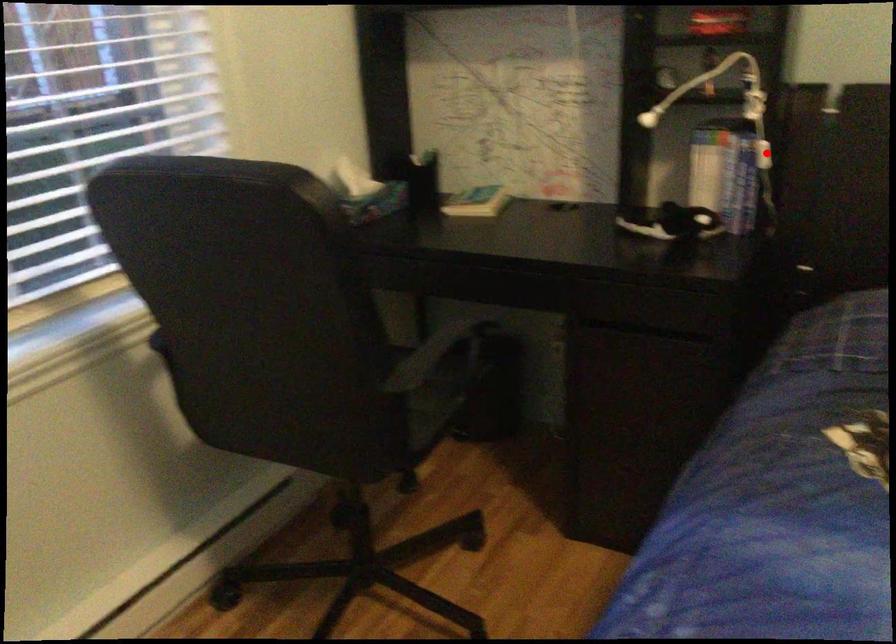
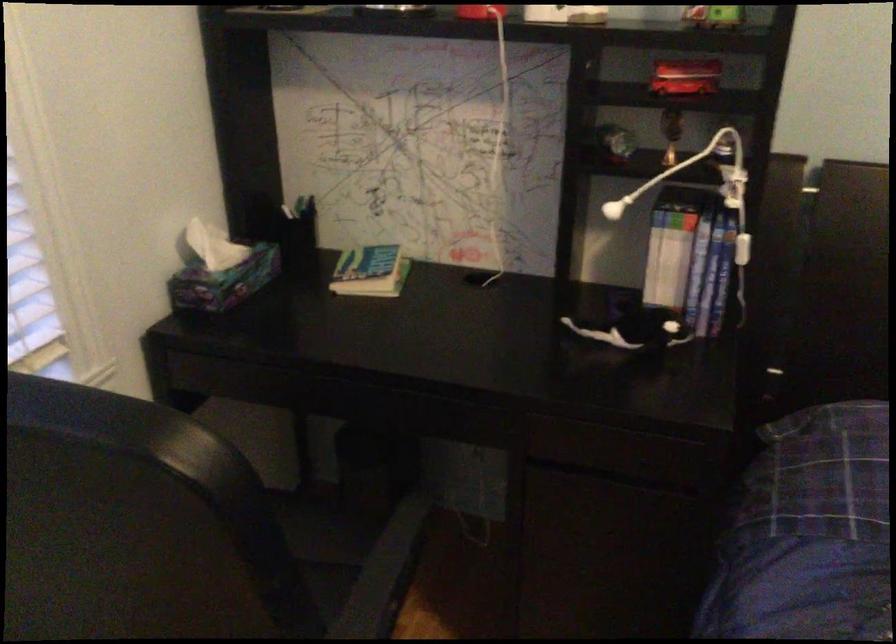
Locate, in the second image, the point that corresponds to the highlighted location in the first image.

(742, 249)